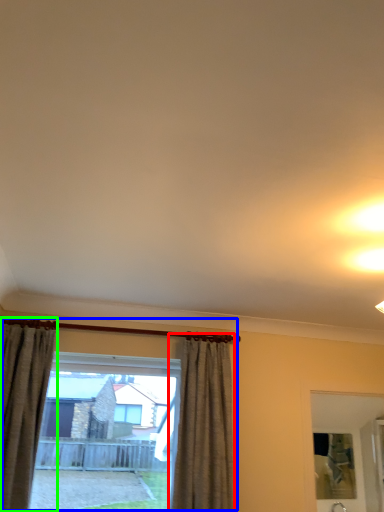
Question: Which object is the farthest from curtain (highlighted by a red box)? Choose among these: window (highlighted by a blue box) or curtain (highlighted by a green box).

Choices:
 (A) window
 (B) curtain

Answer: (B)